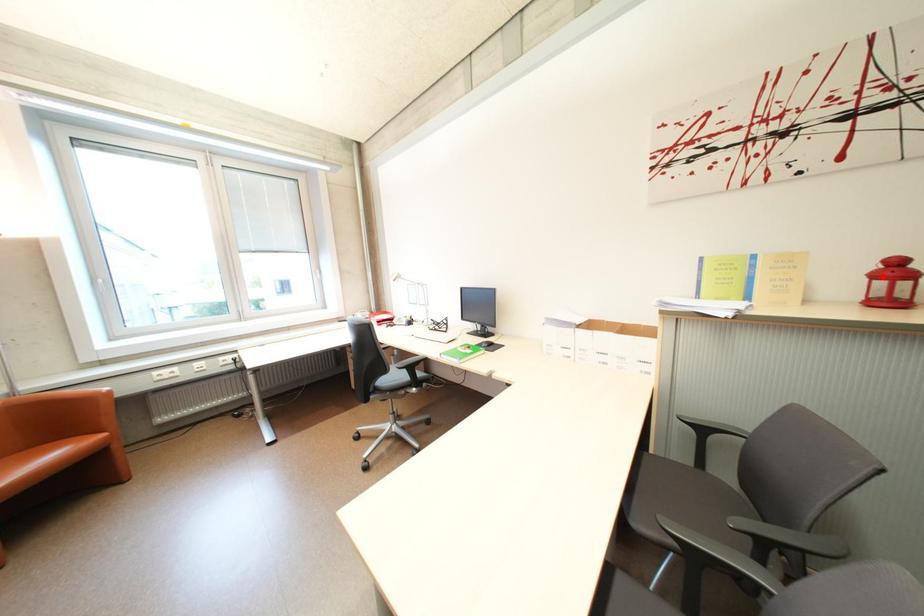
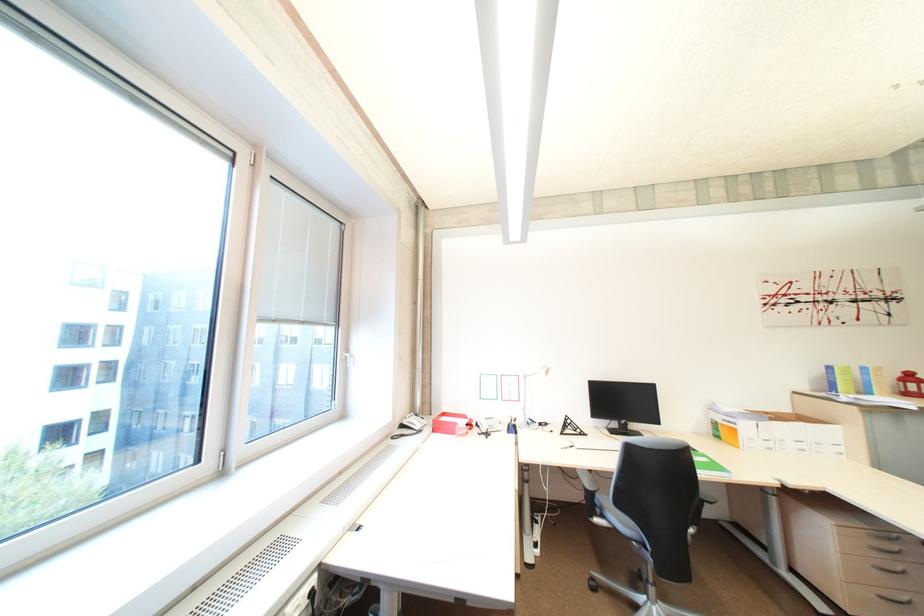
Question: I am providing you with two images of the same scene from different viewpoints. Given a red point in image1, look at the same physical point in image2. Is it:

Choices:
 (A) Closer to the viewpoint
 (B) Farther from the viewpoint

Answer: (A)